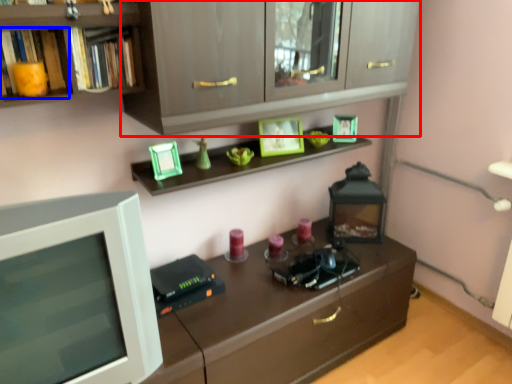
Question: Which object appears farthest to the camera in this image, cabinetry (highlighted by a red box) or book (highlighted by a blue box)?

Choices:
 (A) cabinetry
 (B) book

Answer: (B)